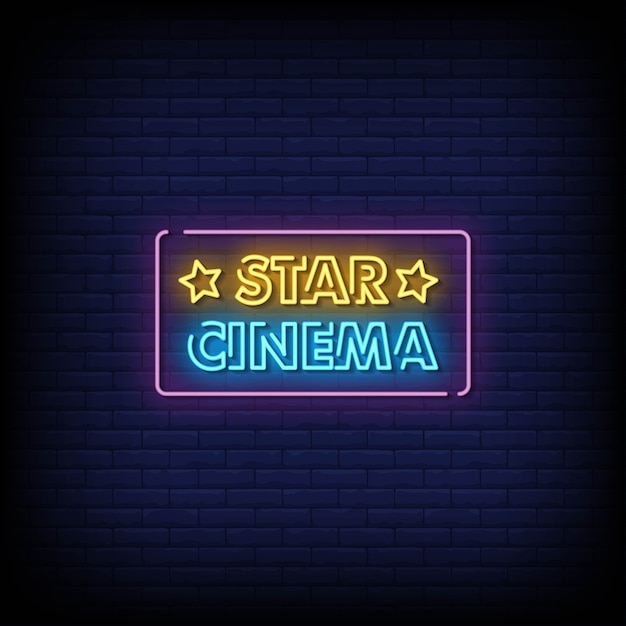
What are the coordinates of `blue brick wall` in the screenshot? It's located at (260, 535), (136, 458), (562, 239), (528, 442).